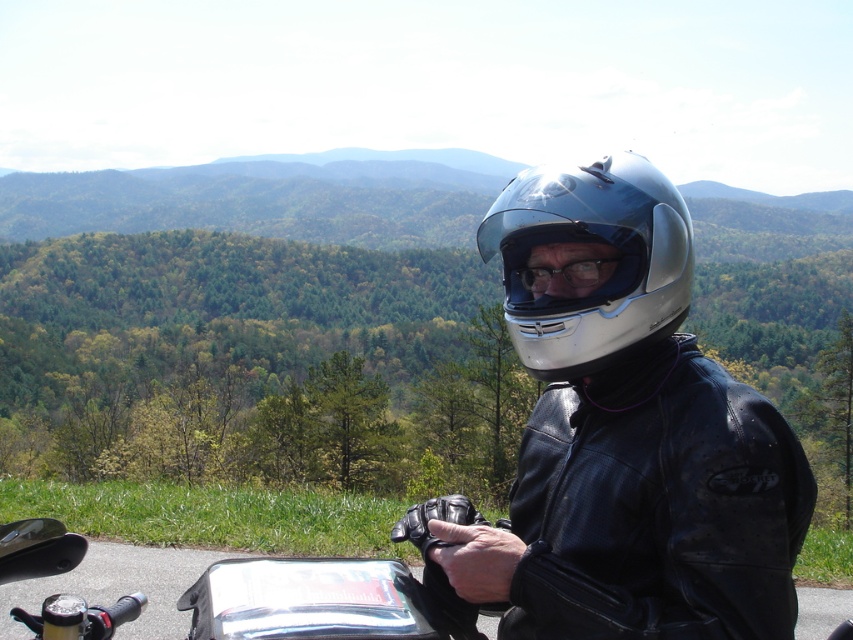
Question: Which object is positioned closest to the black leather jacket at right?

Choices:
 (A) glossy black helmet at center
 (B) glossy white helmet at center
 (C) transparent plastic goggles at center

Answer: (A)

Question: Is glossy black helmet at center closer to camera compared to transparent plastic goggles at center?

Choices:
 (A) yes
 (B) no

Answer: (A)

Question: Is glossy black helmet at center positioned in front of black leather jacket at right?

Choices:
 (A) no
 (B) yes

Answer: (B)

Question: Which object is closer to the camera taking this photo?

Choices:
 (A) glossy black helmet at center
 (B) glossy white helmet at center

Answer: (A)

Question: Does glossy black helmet at center have a lesser width compared to glossy white helmet at center?

Choices:
 (A) no
 (B) yes

Answer: (A)

Question: Which object is positioned farthest from the black leather jacket at right?

Choices:
 (A) glossy black helmet at center
 (B) transparent plastic goggles at center

Answer: (B)